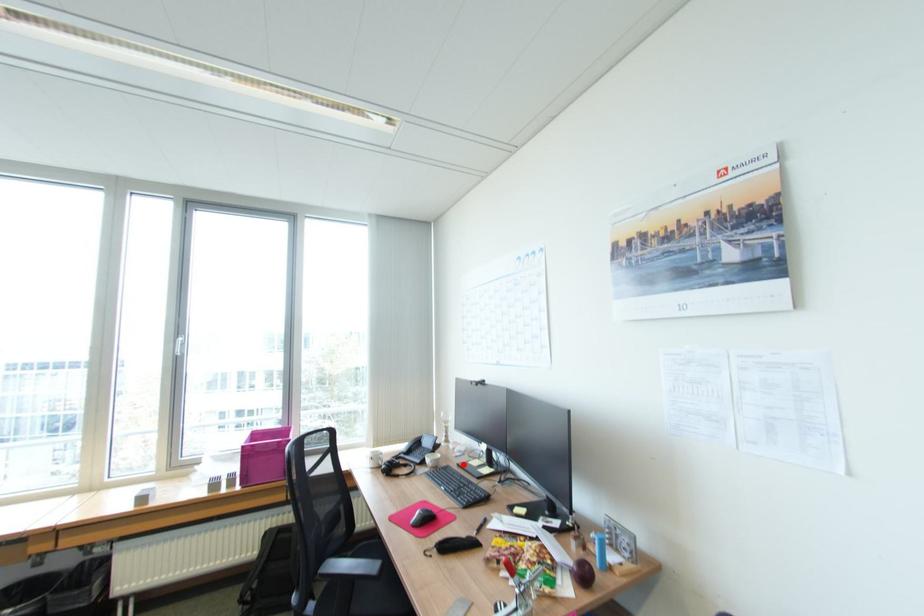
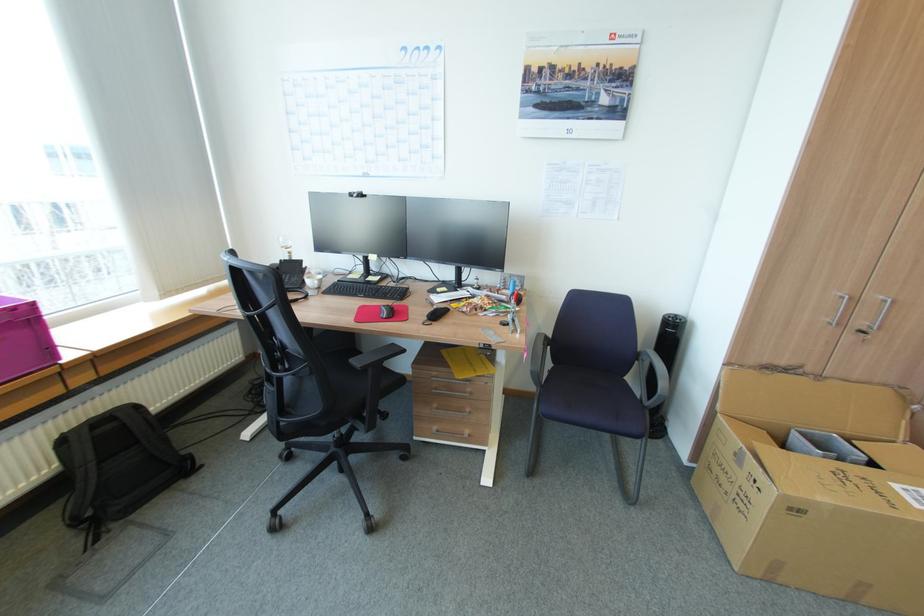
Question: I am providing you with two images of the same scene from different viewpoints. A red point is marked on the first image. Can you still see the location of the red point in image 2?

Choices:
 (A) Yes
 (B) No

Answer: (A)